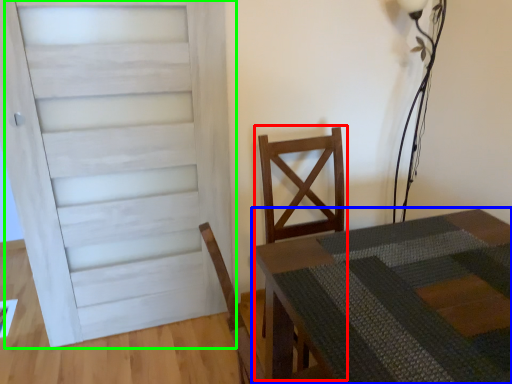
Question: Which is nearer to the armchair (highlighted by a red box)? table (highlighted by a blue box) or door (highlighted by a green box).

Choices:
 (A) table
 (B) door

Answer: (A)